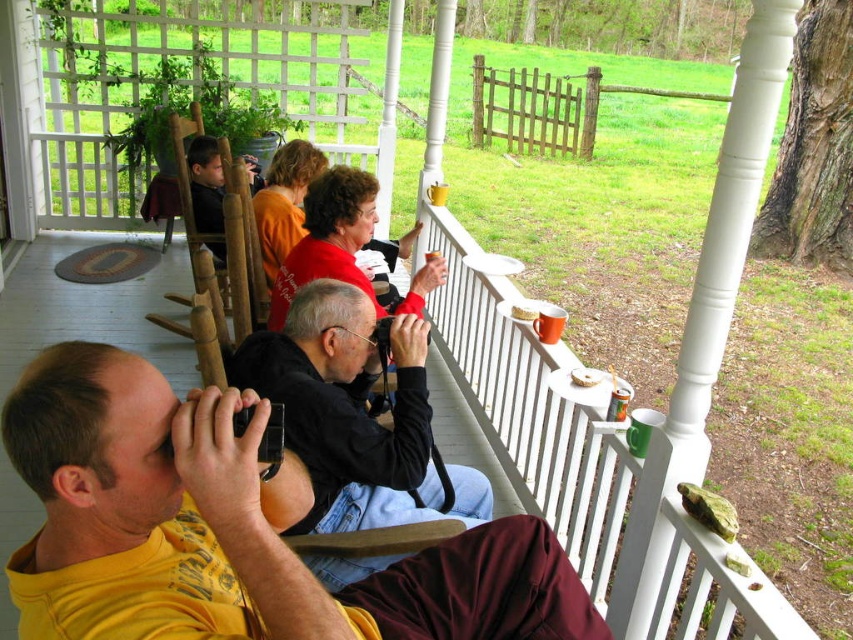
Question: Can you confirm if black matte jacket at center is positioned to the left of crumbly cake at upper center?

Choices:
 (A) no
 (B) yes

Answer: (B)

Question: Among these objects, which one is farthest from the camera?

Choices:
 (A) white crumbly cake at upper center
 (B) yellow t-shirt at center

Answer: (A)

Question: Can you confirm if yellow t-shirt at center is positioned below black matte jacket at center?

Choices:
 (A) no
 (B) yes

Answer: (B)

Question: Is black matte jacket at center bigger than crumbly cake at upper center?

Choices:
 (A) no
 (B) yes

Answer: (B)

Question: Among these objects, which one is nearest to the camera?

Choices:
 (A) brown wooden rocking chair at left
 (B) yellow t-shirt at center
 (C) crumbly cake at upper center

Answer: (B)

Question: Which point appears closest to the camera in this image?

Choices:
 (A) (601, 372)
 (B) (399, 426)
 (C) (527, 314)
 (D) (234, 282)

Answer: (B)